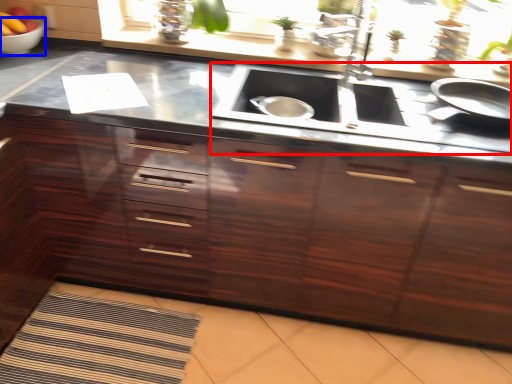
Question: Among these objects, which one is nearest to the camera, stove (highlighted by a red box) or mixing bowl (highlighted by a blue box)?

Choices:
 (A) stove
 (B) mixing bowl

Answer: (A)